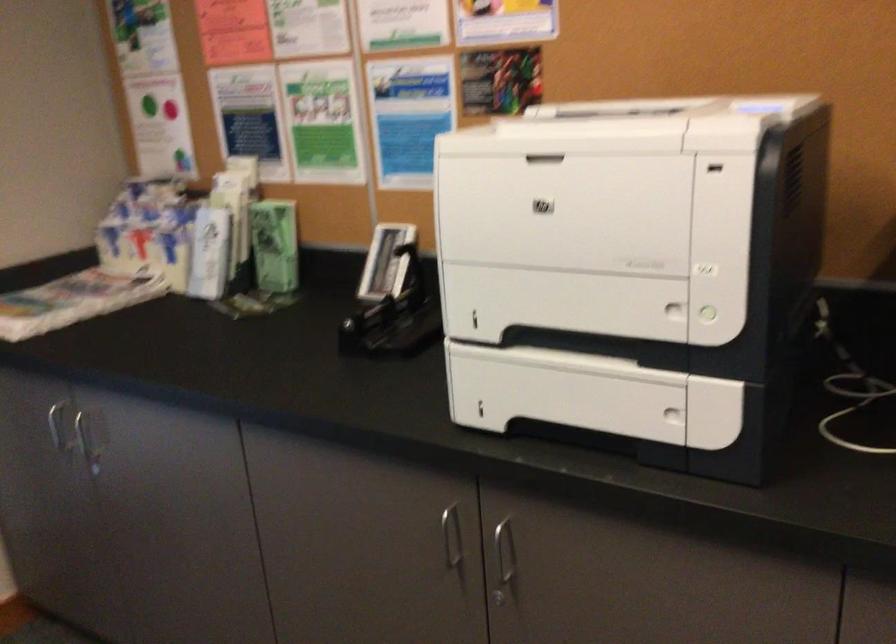
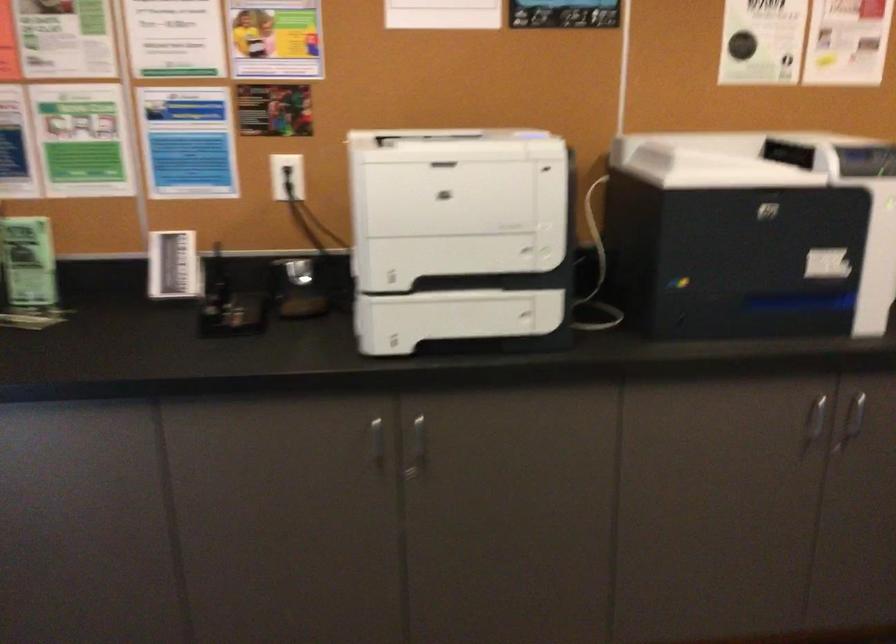
In the second image, find the point that corresponds to pixel 459 544 in the first image.

(376, 442)